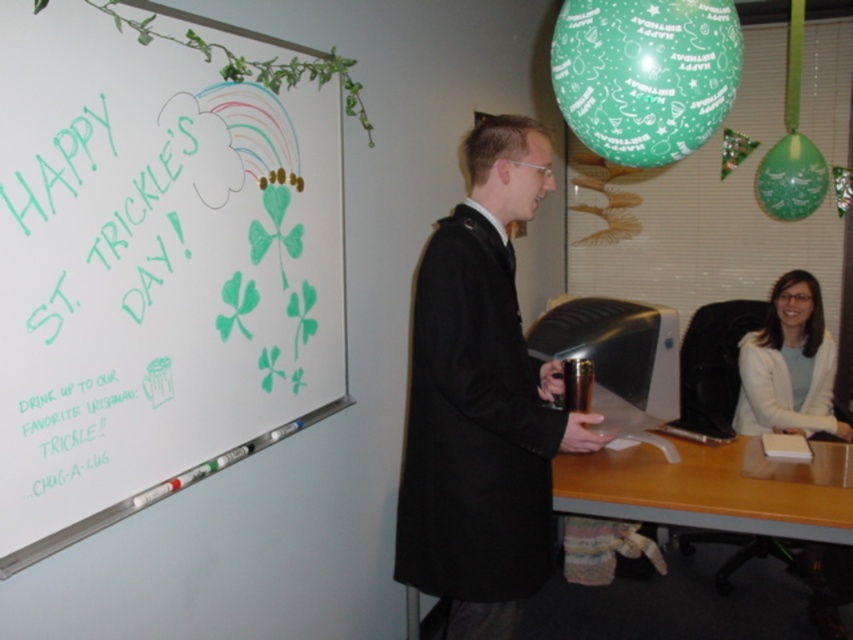
Question: Which point is closer to the camera?

Choices:
 (A) (195, 106)
 (B) (791, 339)
 (C) (577, 488)

Answer: (A)

Question: Where is wooden desk at lower right located in relation to white fabric shirt at right in the image?

Choices:
 (A) left
 (B) right

Answer: (A)

Question: Is whiteboard at upper left closer to camera compared to white fabric shirt at right?

Choices:
 (A) yes
 (B) no

Answer: (A)

Question: Which point appears closest to the camera in this image?

Choices:
 (A) tap(1, 470)
 (B) tap(788, 515)

Answer: (A)

Question: Considering the real-world distances, which object is closest to the green chalk writing at upper left?

Choices:
 (A) black wool coat at center
 (B) whiteboard at upper left
 (C) white fabric shirt at right

Answer: (B)

Question: From the image, what is the correct spatial relationship of whiteboard at upper left in relation to green chalk writing at upper left?

Choices:
 (A) above
 (B) below

Answer: (A)